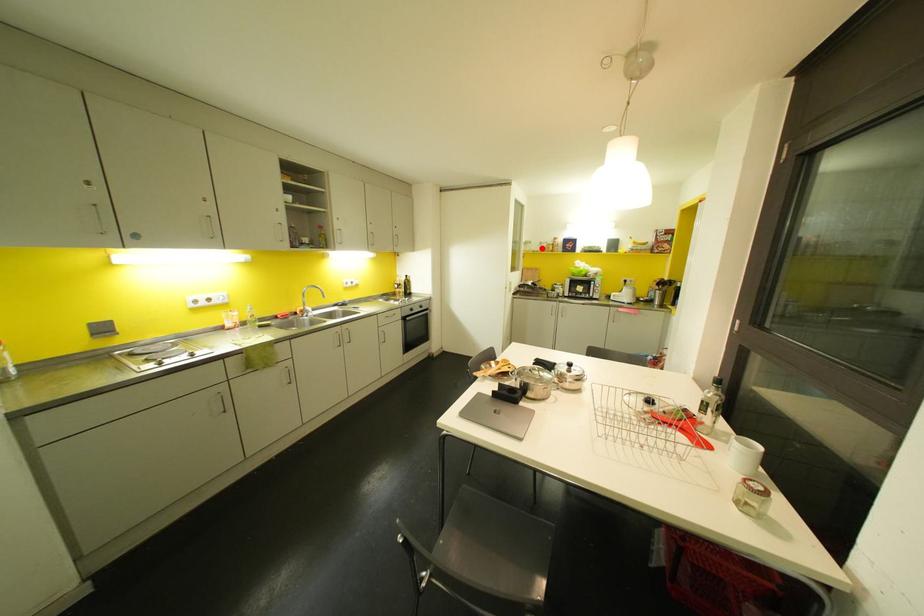
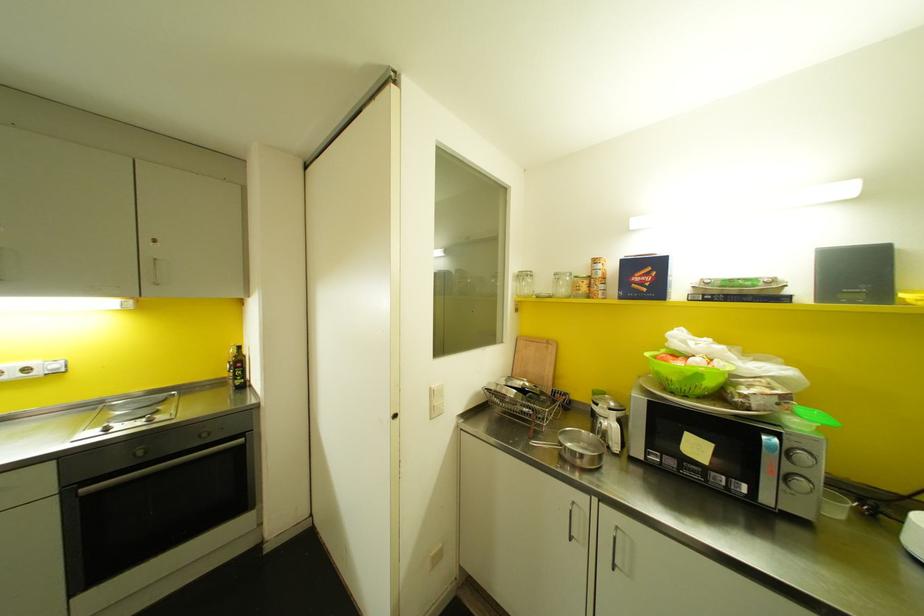
In the second image, find the point that corresponds to the highlighted location in the first image.

(562, 290)